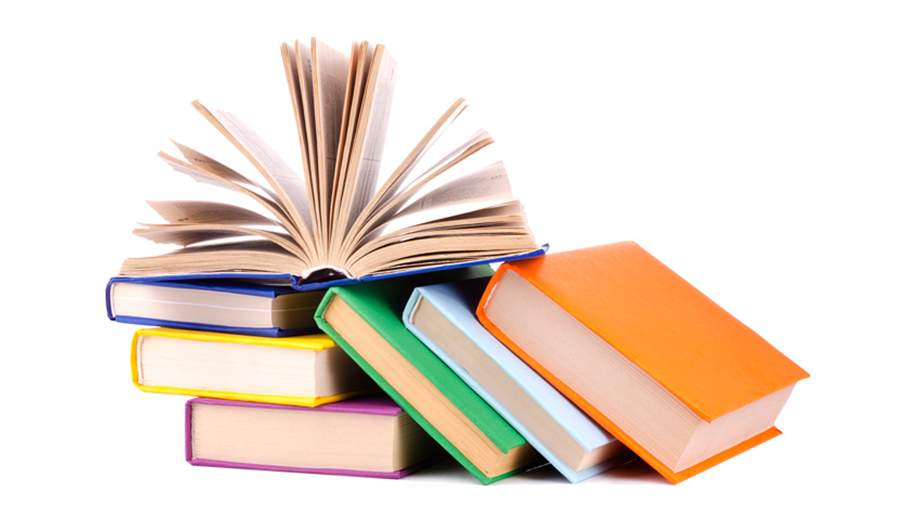
I want to click on closed books, so tap(568, 302), tap(449, 302), tap(374, 307), tap(253, 295), tap(281, 356), tap(319, 433).